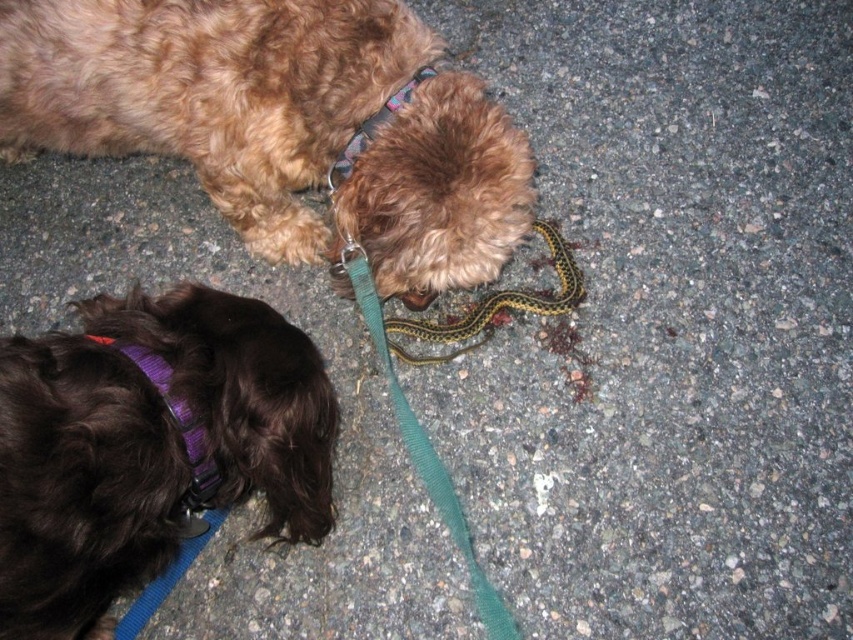
Can you confirm if purple fabric neckband at lower left is smaller than purple fabric neckband at upper center?

Indeed, purple fabric neckband at lower left has a smaller size compared to purple fabric neckband at upper center.

Is purple fabric neckband at lower left positioned in front of purple fabric neckband at upper center?

Yes.

Who is more forward, (184, 508) or (337, 161)?

Point (184, 508) is in front.

Locate an element on the screen. This screenshot has height=640, width=853. purple fabric neckband at lower left is located at coordinates (177, 424).

Is point (561, 310) positioned after point (355, 152)?

Yes, point (561, 310) is farther from viewer.

You are a GUI agent. You are given a task and a screenshot of the screen. Output one action in this format:
    pyautogui.click(x=<x>, y=<y>)
    Task: Click on the yellow-green striped snake at center
    The width and height of the screenshot is (853, 640).
    Given the screenshot: What is the action you would take?
    pyautogui.click(x=496, y=305)

Is green nylon leash at center shorter than purple fabric neckband at lower left?

In fact, green nylon leash at center may be taller than purple fabric neckband at lower left.

Which is in front, point (427, 472) or point (187, 432)?

Point (187, 432)

Is point (352, 273) positioned after point (94, 340)?

Yes, it is behind point (94, 340).

Image resolution: width=853 pixels, height=640 pixels. I want to click on green nylon leash at center, so click(x=424, y=448).